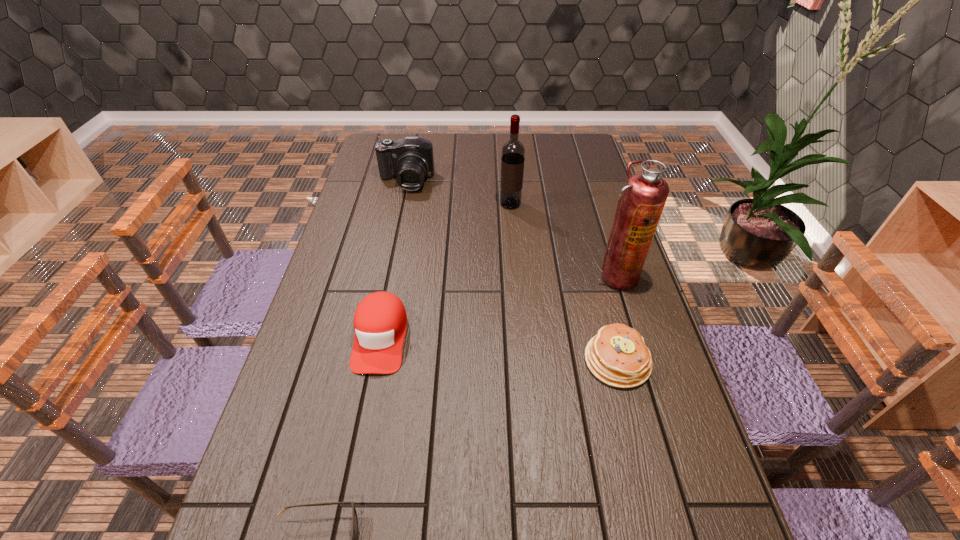
You are a GUI agent. You are given a task and a screenshot of the screen. Output one action in this format:
    pyautogui.click(x=<x>, y=<y>)
    Task: Click on the free spot that satisfies the following two spatial constraints: 1. on the front-facing side of the pancake; 2. on the right side of the baseball cap
    This screenshot has height=540, width=960.
    Given the screenshot: What is the action you would take?
    pyautogui.click(x=375, y=361)

Find the location of a particular element. free region that satisfies the following two spatial constraints: 1. on the lens of the second farthest object; 2. on the left side of the third tallest object is located at coordinates (401, 204).